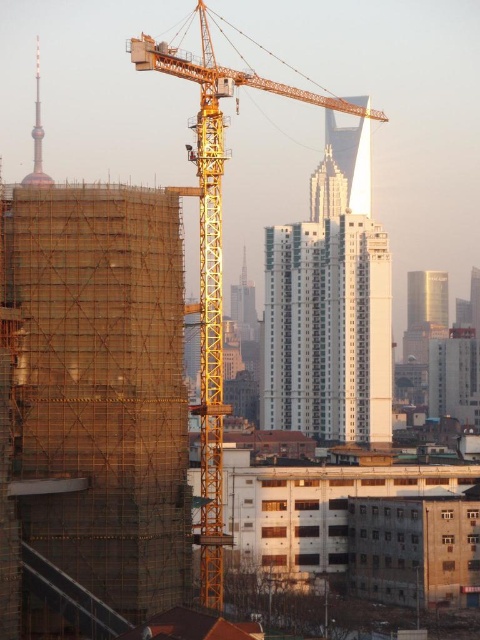
Question: Which point appears closest to the camera in this image?

Choices:
 (A) (439, 275)
 (B) (204, 60)
 (C) (312, 342)
 (D) (40, 150)

Answer: (B)

Question: Can you confirm if white smooth building at center is bigger than shiny gold tower at upper left?

Choices:
 (A) no
 (B) yes

Answer: (B)

Question: Observing the image, what is the correct spatial positioning of yellow metallic crane at center in reference to gold reflective tower at right?

Choices:
 (A) below
 (B) above

Answer: (B)

Question: Which object is the closest to the yellow metallic crane at center?

Choices:
 (A) white smooth building at center
 (B) shiny gold tower at upper left
 (C) gold reflective tower at right

Answer: (A)

Question: Does yellow metallic crane at center appear over shiny gold tower at upper left?

Choices:
 (A) yes
 (B) no

Answer: (B)

Question: Which of the following is the farthest from the observer?

Choices:
 (A) (309, 228)
 (B) (212, 180)
 (C) (431, 312)
 (D) (35, 131)

Answer: (D)